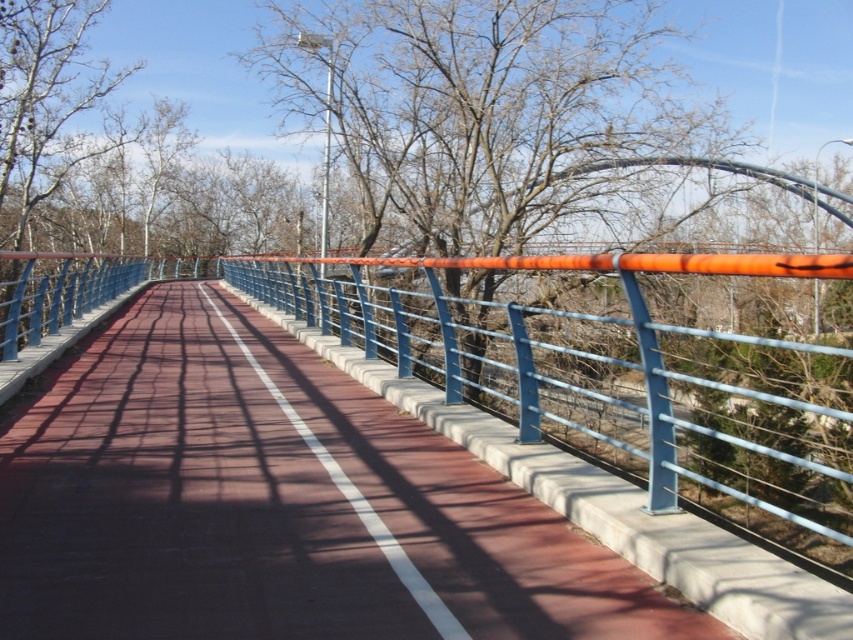
You are standing at the point with coordinates point (410,211) and want to walk towards the point with coordinates point (292,454). According to the scene, which direction should you face to move towards your destination?

Since point (292,454) is in front of point (410,211), you should face the direction towards the point (292,454) to move towards it.